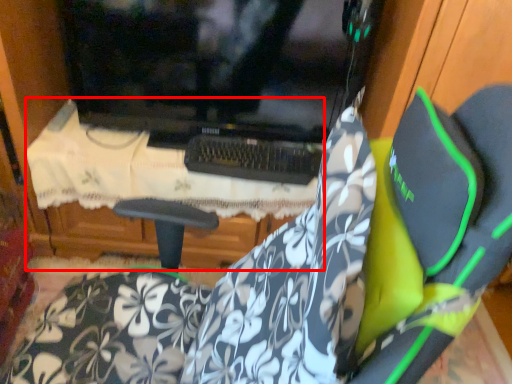
Question: Considering the relative positions of table (annotated by the red box) and fabric in the image provided, where is table (annotated by the red box) located with respect to the staircase?

Choices:
 (A) right
 (B) left

Answer: (B)